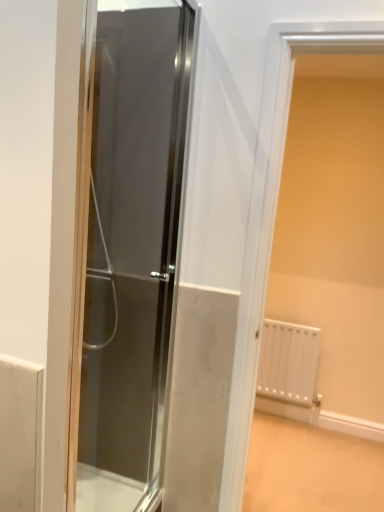
Question: Should I look upward or downward to see transparent glass door at center?

Choices:
 (A) down
 (B) up

Answer: (A)

Question: Does transparent glass door at center contain white matte radiator at right?

Choices:
 (A) no
 (B) yes

Answer: (A)

Question: Can you confirm if transparent glass door at center is taller than white matte radiator at right?

Choices:
 (A) no
 (B) yes

Answer: (B)

Question: Is transparent glass door at center oriented away from white matte radiator at right?

Choices:
 (A) no
 (B) yes

Answer: (A)

Question: Does transparent glass door at center lie in front of white matte radiator at right?

Choices:
 (A) no
 (B) yes

Answer: (B)

Question: Considering the relative sizes of transparent glass door at center and white matte radiator at right in the image provided, is transparent glass door at center thinner than white matte radiator at right?

Choices:
 (A) yes
 (B) no

Answer: (A)

Question: Does transparent glass door at center turn towards white matte radiator at right?

Choices:
 (A) yes
 (B) no

Answer: (A)

Question: Would you say white matte radiator at right is outside transparent glass door at center?

Choices:
 (A) no
 (B) yes

Answer: (B)

Question: Is white matte radiator at right closer to camera compared to transparent glass door at center?

Choices:
 (A) no
 (B) yes

Answer: (A)

Question: Does white matte radiator at right have a larger size compared to transparent glass door at center?

Choices:
 (A) yes
 (B) no

Answer: (A)

Question: Can you confirm if white matte radiator at right is positioned to the left of transparent glass door at center?

Choices:
 (A) yes
 (B) no

Answer: (B)

Question: From the image's perspective, does white matte radiator at right appear higher than transparent glass door at center?

Choices:
 (A) yes
 (B) no

Answer: (B)

Question: Is white matte radiator at right shorter than transparent glass door at center?

Choices:
 (A) no
 (B) yes

Answer: (B)

Question: Is point (183, 88) positioned closer to the camera than point (286, 124)?

Choices:
 (A) farther
 (B) closer

Answer: (B)